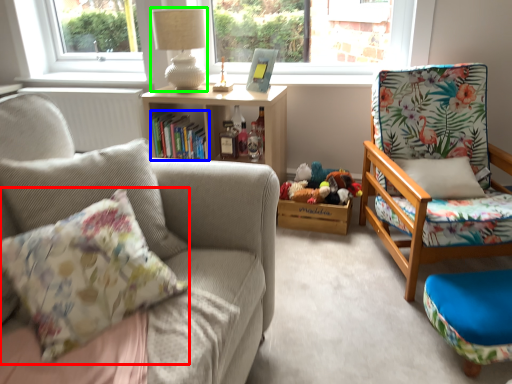
Question: Estimate the real-world distances between objects in this image. Which object is closer to pillow (highlighted by a red box), book (highlighted by a blue box) or lamp (highlighted by a green box)?

Choices:
 (A) book
 (B) lamp

Answer: (A)